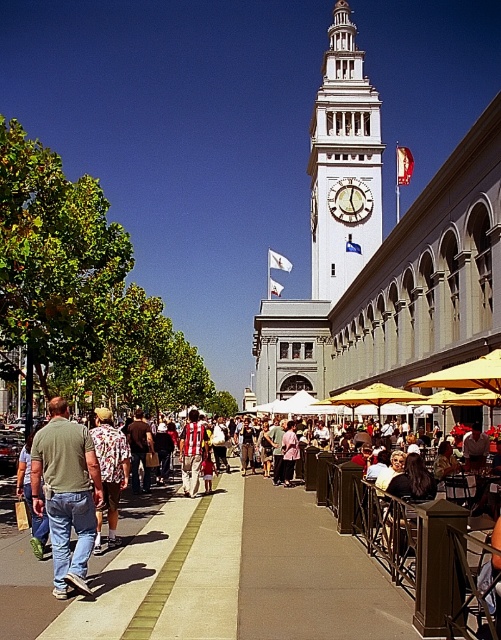
Looking at this image, does matte green shirt at center appear on the left side of striped shirt at center?

Indeed, matte green shirt at center is positioned on the left side of striped shirt at center.

What do you see at coordinates (67, 493) in the screenshot? This screenshot has width=501, height=640. I see `matte green shirt at center` at bounding box center [67, 493].

This screenshot has width=501, height=640. I want to click on matte green shirt at center, so click(x=67, y=493).

Does point (363, 170) come farther from viewer compared to point (359, 198)?

Yes, point (363, 170) is behind point (359, 198).

Who is more distant from viewer, [340,0] or [339,212]?

Positioned behind is point [340,0].

Locate an element on the screen. The width and height of the screenshot is (501, 640). white stone clock tower at center is located at coordinates (344, 164).

Can you confirm if floral shirt at left is taller than wooden clock at center?

Yes.

Who is more distant from viewer, (115, 512) or (347, 211)?

Positioned behind is point (347, 211).

Identify the location of floral shirt at left. (110, 472).